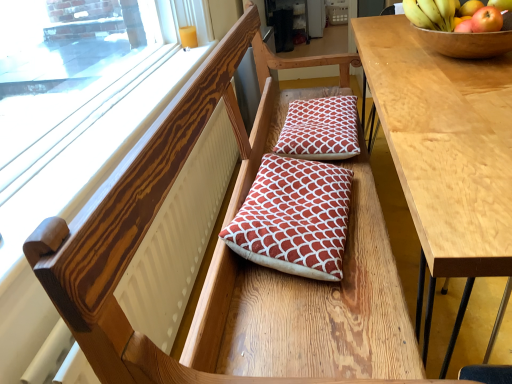
Question: From a real-world perspective, is red quilted cushion at center, the first pillow viewed from the back, over wooden bowl at upper right?

Choices:
 (A) yes
 (B) no

Answer: (B)

Question: Does red quilted cushion at center, the first pillow viewed from the back, have a greater width compared to wooden bowl at upper right?

Choices:
 (A) yes
 (B) no

Answer: (B)

Question: Does red quilted cushion at center, placed as the second pillow when sorted from front to back, have a lesser width compared to wooden bowl at upper right?

Choices:
 (A) yes
 (B) no

Answer: (A)

Question: Is red quilted cushion at center, the first pillow viewed from the back, at the right side of wooden bowl at upper right?

Choices:
 (A) yes
 (B) no

Answer: (B)

Question: Is red quilted cushion at center, placed as the second pillow when sorted from front to back, to the left of wooden bowl at upper right from the viewer's perspective?

Choices:
 (A) yes
 (B) no

Answer: (A)

Question: Can you confirm if red quilted cushion at center, placed as the second pillow when sorted from front to back, is smaller than wooden bowl at upper right?

Choices:
 (A) yes
 (B) no

Answer: (A)

Question: Is wooden frame at upper left outside wooden bowl at upper right?

Choices:
 (A) yes
 (B) no

Answer: (A)

Question: Considering the relative sizes of wooden frame at upper left and wooden bowl at upper right in the image provided, is wooden frame at upper left bigger than wooden bowl at upper right?

Choices:
 (A) yes
 (B) no

Answer: (A)

Question: Would you say wooden frame at upper left is a long distance from wooden bowl at upper right?

Choices:
 (A) no
 (B) yes

Answer: (A)

Question: From the image's perspective, is wooden frame at upper left located beneath wooden bowl at upper right?

Choices:
 (A) yes
 (B) no

Answer: (A)

Question: Does wooden frame at upper left appear on the left side of wooden bowl at upper right?

Choices:
 (A) yes
 (B) no

Answer: (A)

Question: From a real-world perspective, is wooden frame at upper left over wooden bowl at upper right?

Choices:
 (A) yes
 (B) no

Answer: (B)

Question: From a real-world perspective, is wooden bowl at upper right positioned over light brown wood table at right based on gravity?

Choices:
 (A) no
 (B) yes

Answer: (B)